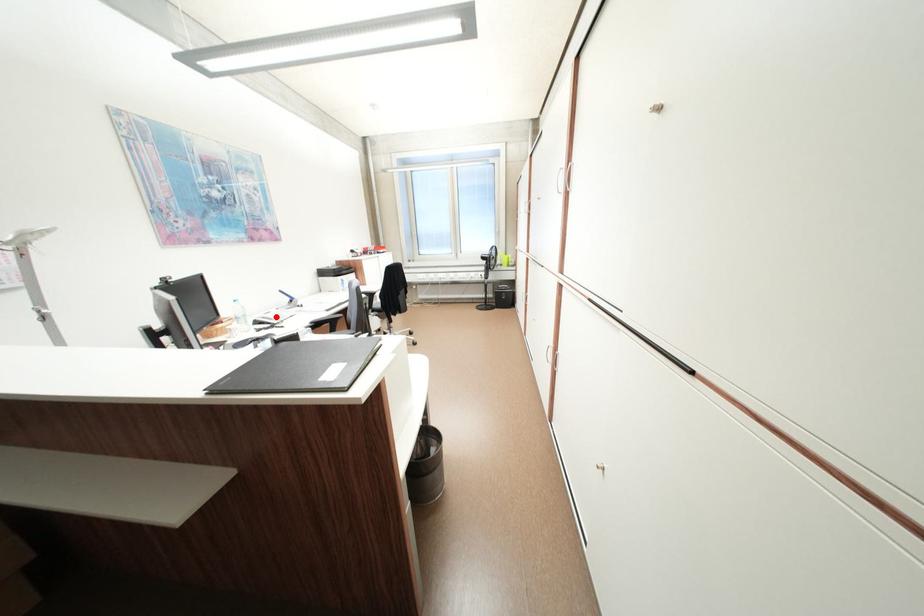
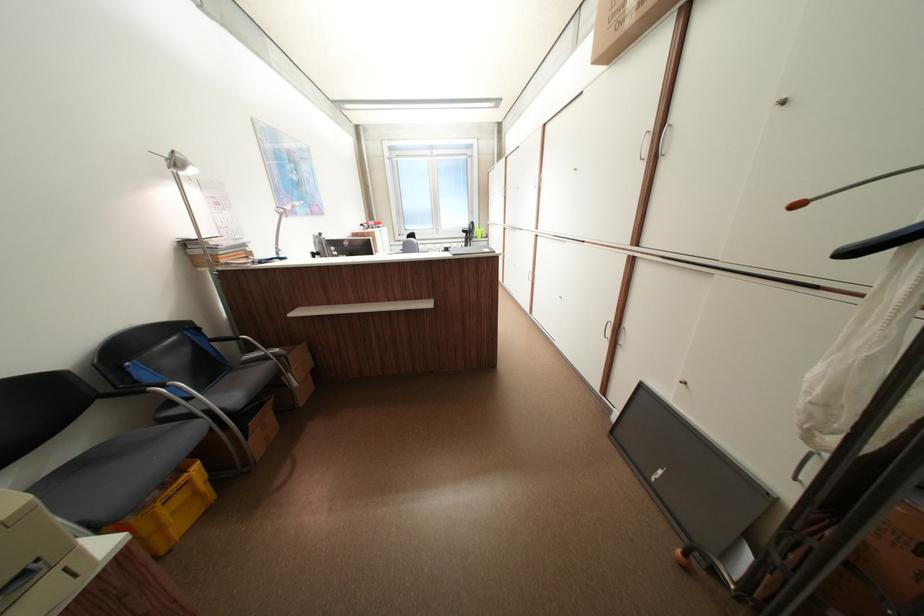
Question: I am providing you with two images of the same scene from different viewpoints. A red point is marked on the first image. At the location where the point appears in image 1, is it still visible in image 2?

Choices:
 (A) Yes
 (B) No

Answer: (B)